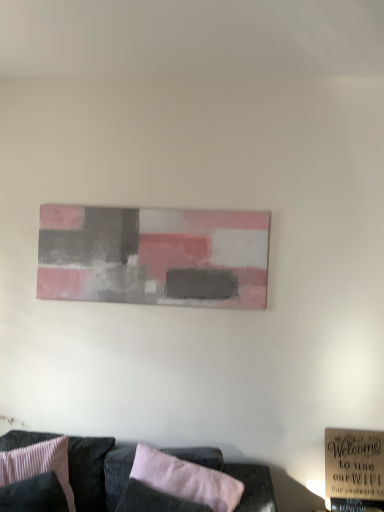
Question: Visually, is pink fabric pillow at lower center, the second pillow positioned from the left, positioned to the left or to the right of velvet black couch at lower center?

Choices:
 (A) left
 (B) right

Answer: (B)

Question: Is pink fabric pillow at lower center, the 1th pillow viewed from the right, taller or shorter than velvet black couch at lower center?

Choices:
 (A) short
 (B) tall

Answer: (A)

Question: Considering the real-world distances, which object is farthest from the pink ribbed fabric pillow at lower left, the 1th pillow when ordered from left to right?

Choices:
 (A) matte acrylic painting at center
 (B) velvet black couch at lower center
 (C) wooden sign at lower right
 (D) pink fabric pillow at lower center, the 1th pillow viewed from the right

Answer: (C)

Question: Estimate the real-world distances between objects in this image. Which object is closer to the pink fabric pillow at lower center, the second pillow positioned from the left?

Choices:
 (A) pink ribbed fabric pillow at lower left, the 1th pillow when ordered from left to right
 (B) velvet black couch at lower center
 (C) matte acrylic painting at center
 (D) wooden sign at lower right

Answer: (B)